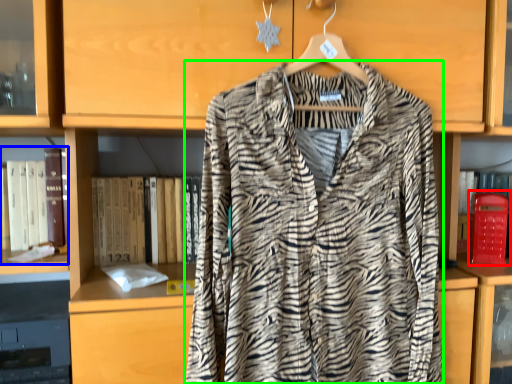
Question: Considering the real-world distances, which object is farthest from phone box (highlighted by a red box)? book (highlighted by a blue box) or fancy dress (highlighted by a green box)?

Choices:
 (A) book
 (B) fancy dress

Answer: (A)